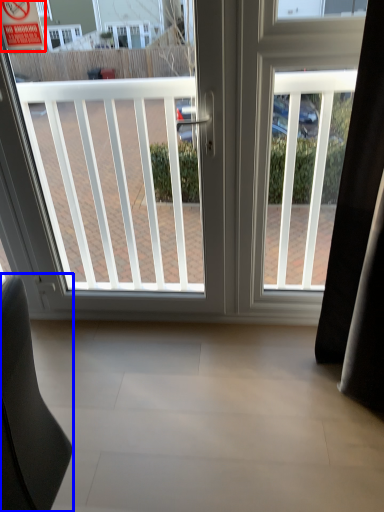
Question: Which point is further to the camera, parking sign (highlighted by a red box) or furniture (highlighted by a blue box)?

Choices:
 (A) parking sign
 (B) furniture

Answer: (A)